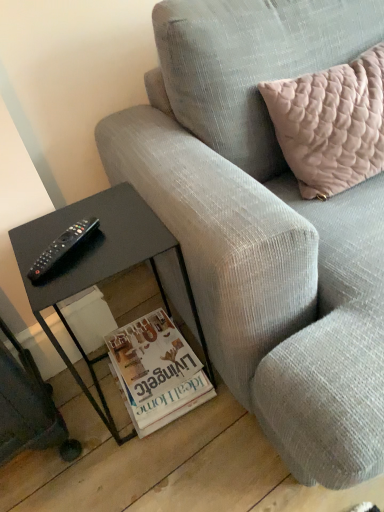
Image resolution: width=384 pixels, height=512 pixels. I want to click on vacant area that is in front of black glass table at lower left, so [x=165, y=465].